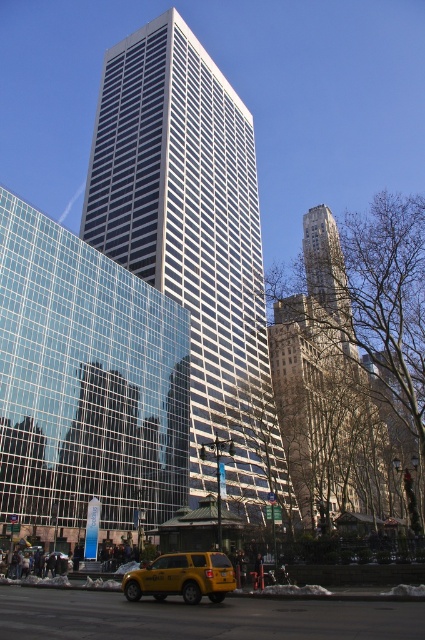
Question: Which point is farther to the camera?

Choices:
 (A) (206, 484)
 (B) (112, 365)
 (C) (348, 298)

Answer: (C)

Question: Is clear glass building at center closer to camera compared to yellow matte taxi at center?

Choices:
 (A) yes
 (B) no

Answer: (A)

Question: Does yellow matte taxi at lower center appear on the right side of yellow matte taxi at center?

Choices:
 (A) yes
 (B) no

Answer: (A)

Question: Which point is farther to the camera?

Choices:
 (A) yellow matte taxi at lower center
 (B) yellow matte taxi at center
 (C) white glass building at center

Answer: (C)

Question: Is white glass building at center to the left of brown stone tower at center from the viewer's perspective?

Choices:
 (A) yes
 (B) no

Answer: (A)

Question: Which is nearer to the yellow matte taxi at center?

Choices:
 (A) yellow matte taxi at lower center
 (B) white glass building at center
 (C) clear glass building at center
 (D) brown stone tower at center

Answer: (C)